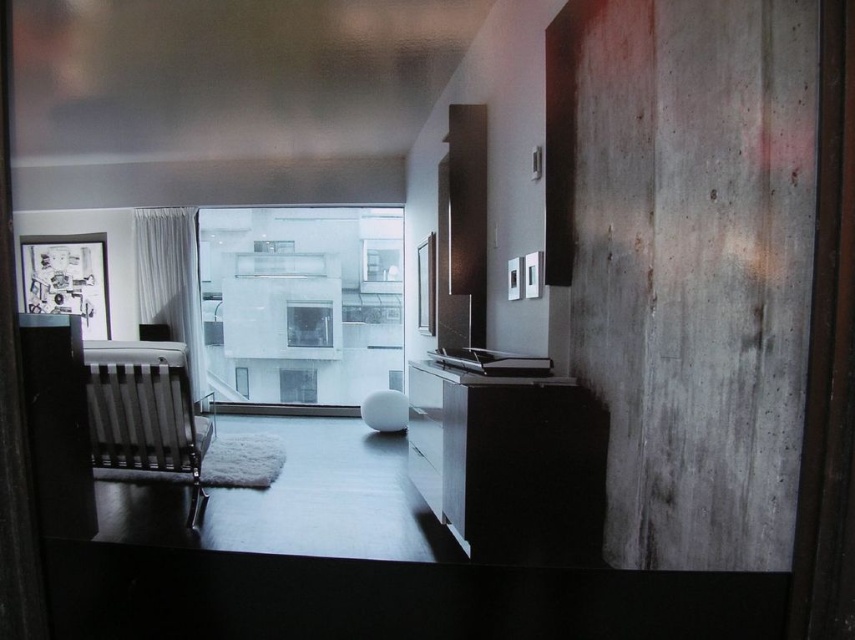
Looking at this image, you are a delivery person trying to enter the apartment through the transparent glass door at center. The black textured rocking chair at left is blocking the door. Can you move the chair to access the door?

The transparent glass door at center is bigger than black textured rocking chair at left, so you can move the black textured rocking chair at left aside to access the door since it is smaller than the door.

You are standing in the room and want to exit through the transparent glass door at center. However, you notice another transparent glass window at center. How can you ensure you are approaching the correct exit?

The transparent glass door at center is closer to the viewer than the transparent glass window at center, so you should approach the one that appears nearer to exit.